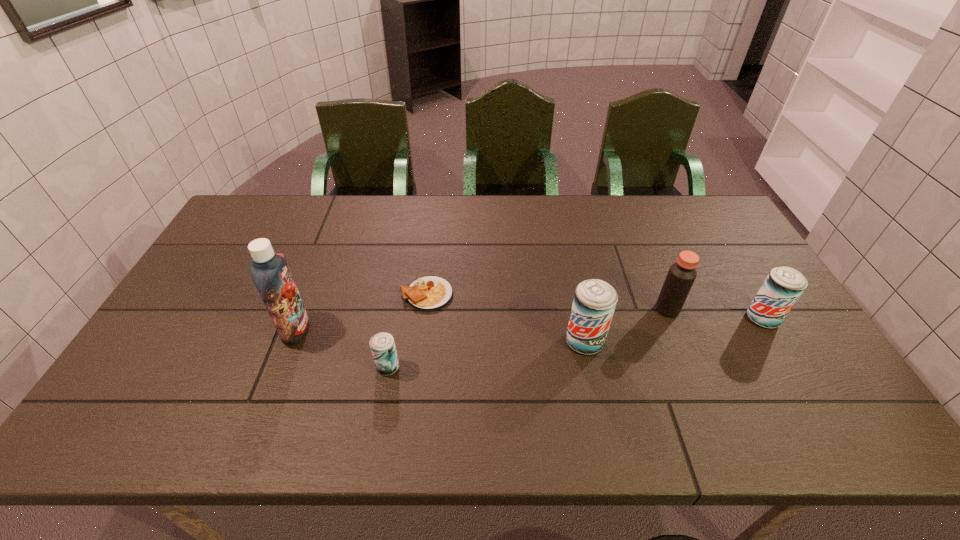
The height and width of the screenshot is (540, 960). I want to click on free region at the far left corner of the desktop, so click(x=248, y=215).

Locate an element on the screen. The image size is (960, 540). unoccupied area between the vinegar and the omelet is located at coordinates (547, 302).

Identify the location of vacant region between the second beer can from right to left and the shortest beer can. (486, 354).

In order to click on blank region between the nearest object and the omelet in this screenshot , I will do `click(407, 330)`.

Where is `free space between the second beer can from right to left and the vinegar`? This screenshot has height=540, width=960. free space between the second beer can from right to left and the vinegar is located at coordinates (626, 326).

Locate an element on the screen. The height and width of the screenshot is (540, 960). empty location between the shampoo and the second shortest beer can is located at coordinates (529, 324).

I want to click on vacant space in between the second object from right to left and the leftmost beer can, so click(x=528, y=338).

This screenshot has height=540, width=960. What are the coordinates of `empty space that is in between the shortest object and the nearest object` in the screenshot? It's located at (407, 330).

Identify the location of blank region between the fifth tallest object and the fourth object from left to right. (486, 354).

Find the location of `the fourth closest object to the second shortest object`. the fourth closest object to the second shortest object is located at coordinates (x=681, y=275).